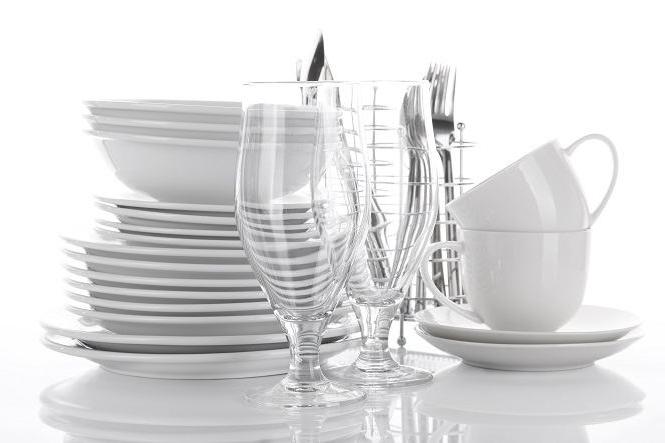
Where is `cups, saucers and glasses`? The height and width of the screenshot is (443, 665). cups, saucers and glasses is located at coordinates (561, 209), (551, 260), (622, 325), (593, 360), (311, 335), (374, 313).